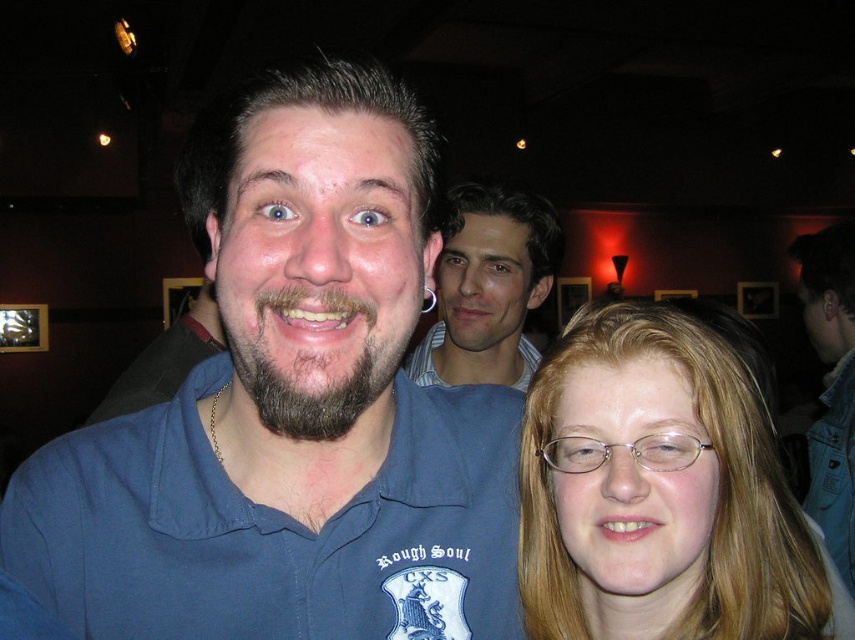
You are a bartender at the bar and need to place a blue cotton polo shirt at center and a denim jacket at lower right on the same hanger. Which one should you place first to ensure they both fit on the hanger?

The blue cotton polo shirt at center is wider than the denim jacket at lower right, so you should place the blue cotton polo shirt at center first to ensure both fit on the hanger.

You are a fashion designer observing the image. You need to decide which garment is shorter between the blue cotton polo shirt at center and the denim jacket at lower right. Which one is shorter?

The blue cotton polo shirt at center is shorter than the denim jacket at lower right.

You are taking a photo of the scene and want to focus on both point (75,442) and point (818,496). Which point should you focus on first to ensure both are in focus?

Point (75,442) is closer to the camera than point (818,496), so you should focus on point (75,442) first to ensure both are in focus.